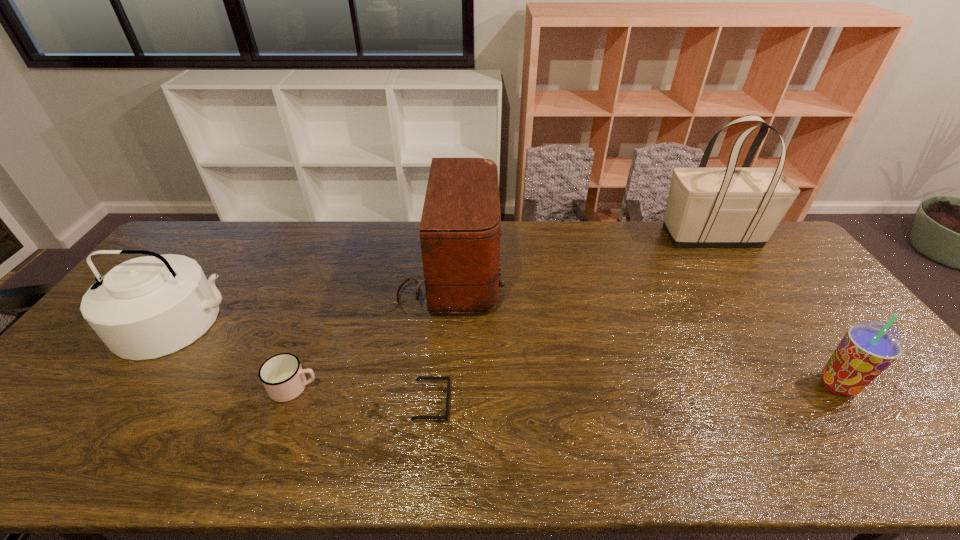
Image resolution: width=960 pixels, height=540 pixels. I want to click on free space that is in between the fifth shortest object and the shopping bag, so click(x=580, y=255).

The image size is (960, 540). In order to click on vacant area between the tallest object and the smoothie in this screenshot , I will do `click(774, 311)`.

In order to click on vacant point located between the second shortest object and the smoothie in this screenshot , I will do `click(565, 386)`.

Where is `vacant area that lies between the tallest object and the sunglasses`? vacant area that lies between the tallest object and the sunglasses is located at coordinates (571, 320).

You are a GUI agent. You are given a task and a screenshot of the screen. Output one action in this format:
    pyautogui.click(x=<x>, y=<y>)
    Task: Click on the unoccupied position between the shortest object and the fifth tallest object
    Image resolution: width=960 pixels, height=540 pixels.
    Given the screenshot: What is the action you would take?
    pyautogui.click(x=363, y=395)

Identify the location of free space between the sunglasses and the leftmost object. This screenshot has width=960, height=540. pos(305,362).

Locate an element on the screen. The image size is (960, 540). empty space between the tallest object and the second tallest object is located at coordinates (580, 255).

You are a GUI agent. You are given a task and a screenshot of the screen. Output one action in this format:
    pyautogui.click(x=<x>, y=<y>)
    Task: Click on the object that is the fifth nearest to the smoothie
    The image size is (960, 540).
    Given the screenshot: What is the action you would take?
    pyautogui.click(x=147, y=307)

Choose which object is the fifth nearest neighbor to the fifth tallest object. Please provide its 2D coordinates. Your answer should be formatted as a tuple, i.e. [(x, y)], where the tuple contains the x and y coordinates of a point satisfying the conditions above.

[(868, 348)]

Where is `vacant space that satisfies the following two spatial constraints: 1. on the front panel of the second tallest object; 2. on the back side of the smoothie`? vacant space that satisfies the following two spatial constraints: 1. on the front panel of the second tallest object; 2. on the back side of the smoothie is located at coordinates (439, 385).